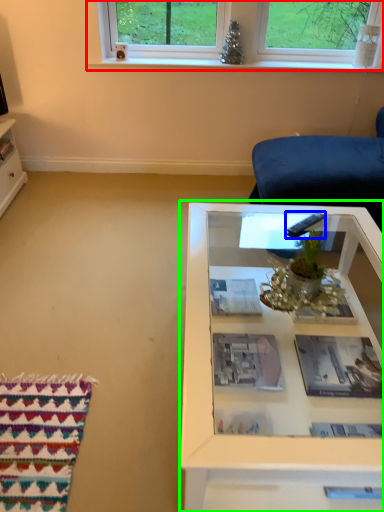
Question: Estimate the real-world distances between objects in this image. Which object is farther from window (highlighted by a red box), remote (highlighted by a blue box) or table (highlighted by a green box)?

Choices:
 (A) remote
 (B) table

Answer: (B)